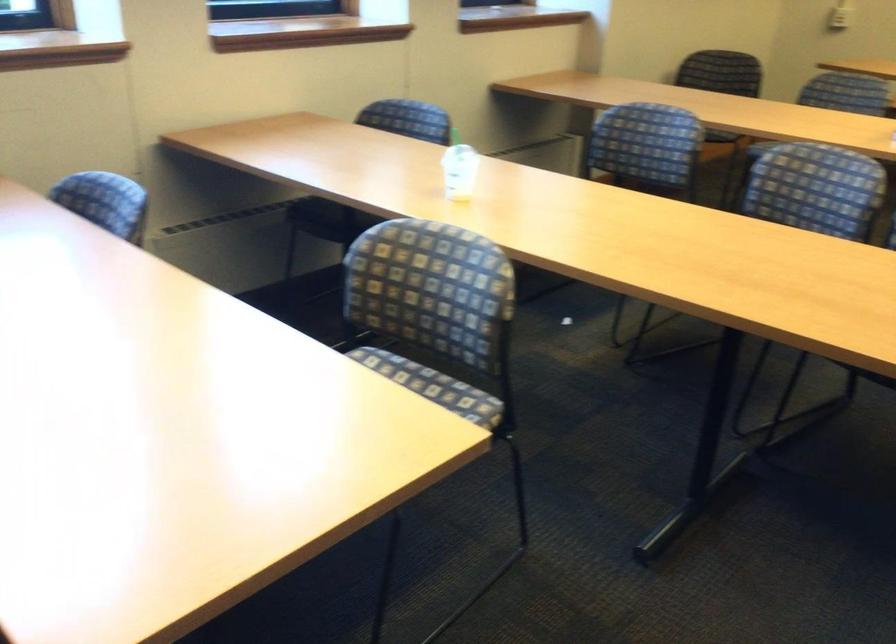
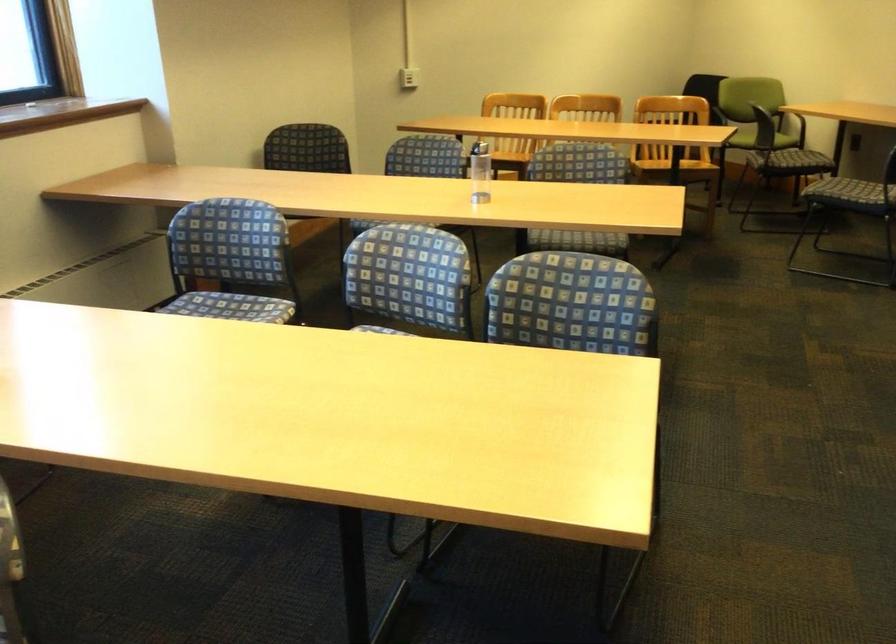
Question: The camera is either moving clockwise (left) or counter-clockwise (right) around the object. The first image is from the beginning of the video and the second image is from the end. Is the camera moving left or right when shooting the video?

Choices:
 (A) Left
 (B) Right

Answer: (A)